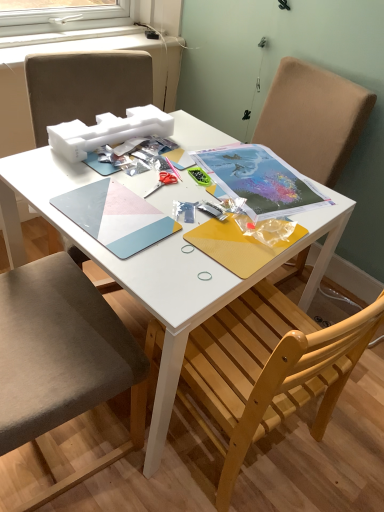
Where is `free space above matte paper notebook at center, the 1th notebook from the right (from a real-world perspective)`? This screenshot has width=384, height=512. free space above matte paper notebook at center, the 1th notebook from the right (from a real-world perspective) is located at coordinates (249, 173).